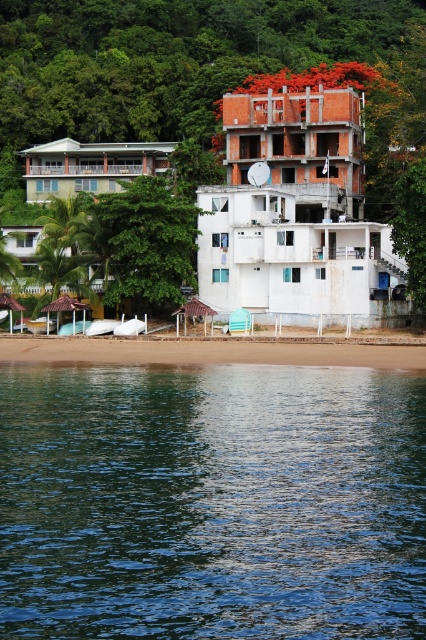
You are planning to build a small sandcastle on the beach. The sandcastle requires a base that is wider than the white matte building at center. Can the brown sand at lower center provide enough space for this?

The brown sand at lower center has a larger width than the white matte building at center, so it can provide enough space for the sandcastle base that needs to be wider than the building.

You are standing on the brown sand at lower center and want to reach the white matte building at center. Based on the scene description, which direction should you move to get closer to the building?

Since the brown sand at lower center is shorter than the white matte building at center, you should move upward towards the building to get closer.